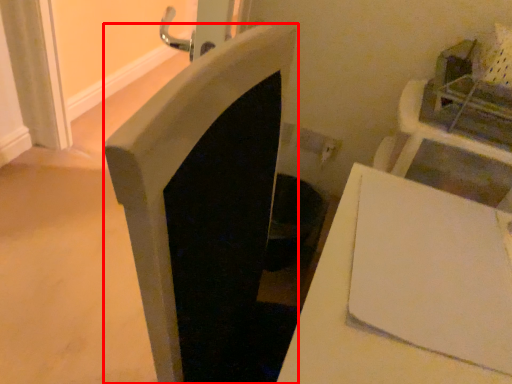
Question: Observing the image, what is the correct spatial positioning of fireplace (annotated by the red box) in reference to table?

Choices:
 (A) left
 (B) right

Answer: (A)